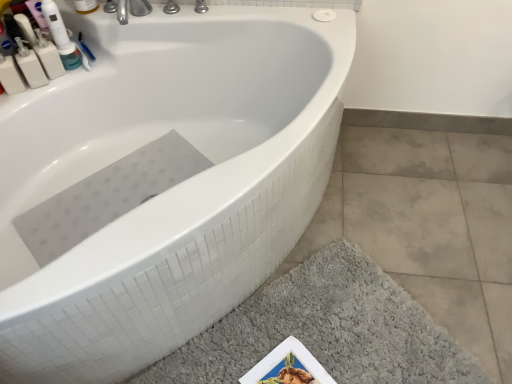
Where is `free point above gray rubber mat at lower left (from a real-world perspective)`? This screenshot has width=512, height=384. free point above gray rubber mat at lower left (from a real-world perspective) is located at coordinates (109, 172).